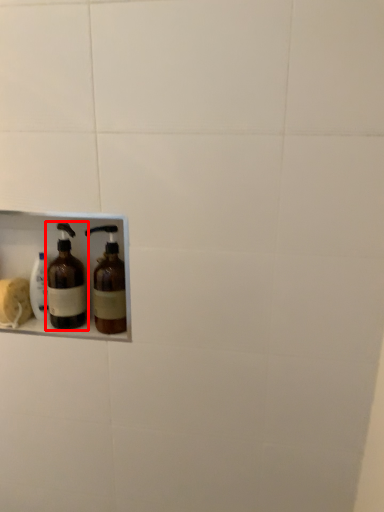
Question: In this image, where is bottle (annotated by the red box) located relative to bottle?

Choices:
 (A) left
 (B) right

Answer: (A)